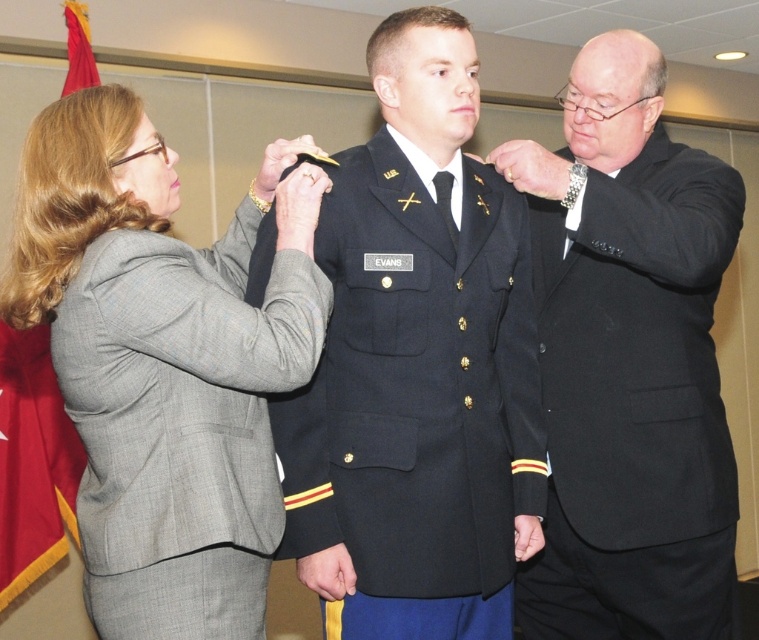
Question: Is the position of gray wool suit at left less distant than that of navy blue wool uniform at center?

Choices:
 (A) yes
 (B) no

Answer: (A)

Question: In this image, where is gray wool suit at left located relative to black suit at right?

Choices:
 (A) left
 (B) right

Answer: (A)

Question: Considering the real-world distances, which object is closest to the black suit at right?

Choices:
 (A) navy blue wool uniform at center
 (B) gray wool suit at left

Answer: (A)

Question: Can you confirm if gray wool suit at left is wider than black suit at right?

Choices:
 (A) yes
 (B) no

Answer: (A)

Question: Which point is farther to the camera?

Choices:
 (A) black suit at right
 (B) gray wool suit at left
 (C) navy blue wool uniform at center

Answer: (A)

Question: Which object appears farthest from the camera in this image?

Choices:
 (A) black suit at right
 (B) gray wool suit at left
 (C) navy blue wool uniform at center

Answer: (A)